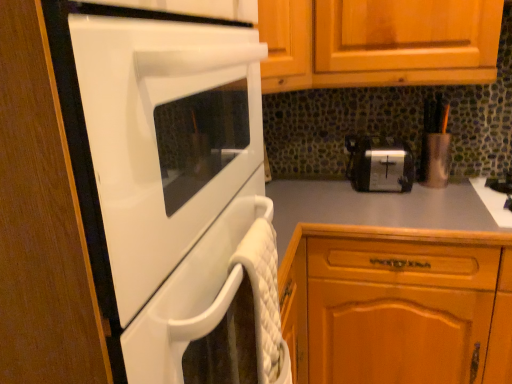
What is the approximate width of wooden cabinet at lower right?

wooden cabinet at lower right is 62.90 centimeters in width.

At what (x,y) coordinates should I click in order to perform the action: click on silver metallic toaster at center. Please return your answer as a coordinate pair (x, y). Looking at the image, I should click on (379, 164).

What is the approximate height of silver metallic toaster at center?

18.10 centimeters.

In order to click on wooden cabinet at lower right in this screenshot , I will do `click(397, 305)`.

Is white glossy oven at left taller or shorter than black matte gas stove at right?

white glossy oven at left is taller than black matte gas stove at right.

From a real-world perspective, who is located higher, white glossy oven at left or black matte gas stove at right?

In real-world perspective, white glossy oven at left is above.

Can you tell me how much white glossy oven at left and black matte gas stove at right differ in facing direction?

There is a 90-degree angle between the facing directions of white glossy oven at left and black matte gas stove at right.

Could you tell me if white glossy oven at left is facing black matte gas stove at right?

No, white glossy oven at left does not turn towards black matte gas stove at right.

From the image's perspective, is black matte gas stove at right over white glossy oven at left?

Correct, black matte gas stove at right appears higher than white glossy oven at left in the image.

Is white glossy oven at left a part of black matte gas stove at right?

Actually, white glossy oven at left is outside black matte gas stove at right.

Which object is wider, black matte gas stove at right or white glossy oven at left?

With larger width is white glossy oven at left.

Is silver metallic toaster at center spatially inside black matte gas stove at right, or outside of it?

silver metallic toaster at center is outside black matte gas stove at right.

From the image's perspective, is silver metallic toaster at center on top of black matte gas stove at right?

Yes, from the image's perspective, silver metallic toaster at center is above black matte gas stove at right.

Can you tell me how much silver metallic toaster at center and black matte gas stove at right differ in facing direction?

silver metallic toaster at center and black matte gas stove at right are facing 0.00273 degrees away from each other.

Which object is positioned more to the left, silver metallic toaster at center or black matte gas stove at right?

silver metallic toaster at center.

From a real-world perspective, between wooden cabinet at lower right and silver metallic toaster at center, who is vertically higher?

silver metallic toaster at center, from a real-world perspective.

Is silver metallic toaster at center inside wooden cabinet at lower right?

No, silver metallic toaster at center is located outside of wooden cabinet at lower right.

Consider the image. In terms of height, does wooden cabinet at lower right look taller or shorter compared to silver metallic toaster at center?

In the image, wooden cabinet at lower right appears to be taller than silver metallic toaster at center.

Who is more distant, black matte gas stove at right or wooden cabinet at lower right?

black matte gas stove at right is behind.

You are a GUI agent. You are given a task and a screenshot of the screen. Output one action in this format:
    pyautogui.click(x=<x>, y=<y>)
    Task: Click on the cabinetry in front of the black matte gas stove at right
    The width and height of the screenshot is (512, 384).
    Given the screenshot: What is the action you would take?
    pyautogui.click(x=397, y=305)

Is wooden cabinet at lower right located within black matte gas stove at right?

Actually, wooden cabinet at lower right is outside black matte gas stove at right.

From a real-world perspective, which object stands above the other?

white glossy oven at left, from a real-world perspective.

Is point (85, 80) in front of point (364, 161)?

Yes, point (85, 80) is closer to viewer.

From the image's perspective, relative to silver metallic toaster at center, is white glossy oven at left above or below?

white glossy oven at left is below silver metallic toaster at center.

In the image, is white glossy oven at left positioned in front of or behind silver metallic toaster at center?

white glossy oven at left is in front of silver metallic toaster at center.

Based on the photo, is wooden cabinet at lower right directly adjacent to white glossy oven at left?

No, wooden cabinet at lower right is not in contact with white glossy oven at left.

How different are the orientations of wooden cabinet at lower right and white glossy oven at left in degrees?

They differ by 90 degrees in their facing directions.

Is wooden cabinet at lower right positioned behind white glossy oven at left?

Yes, wooden cabinet at lower right is further from the camera.

Which is behind, point (354, 320) or point (194, 38)?

The point (354, 320) is farther from the camera.

Locate an element on the screen. gas stove on the right of white glossy oven at left is located at coordinates (x=493, y=202).

Image resolution: width=512 pixels, height=384 pixels. In order to click on home appliance below the black matte gas stove at right (from the image's perspective) in this screenshot , I will do `click(165, 136)`.

From the image, which object appears to be nearer to wooden cabinet at lower right, white glossy oven at left or black matte gas stove at right?

black matte gas stove at right.

Considering their positions, is wooden cabinet at lower right positioned further to silver metallic toaster at center than black matte gas stove at right?

wooden cabinet at lower right is positioned further to the anchor silver metallic toaster at center.

When comparing their distances from silver metallic toaster at center, does white glossy oven at left or black matte gas stove at right seem further?

Among the two, white glossy oven at left is located further to silver metallic toaster at center.

Consider the image. Based on their spatial positions, is wooden cabinet at lower right or silver metallic toaster at center further from white glossy oven at left?

silver metallic toaster at center is further to white glossy oven at left.

From the image, which object appears to be farther from white glossy oven at left, silver metallic toaster at center or black matte gas stove at right?

Based on the image, black matte gas stove at right appears to be further to white glossy oven at left.

Which object lies nearer to the anchor point black matte gas stove at right, wooden cabinet at lower right or silver metallic toaster at center?

silver metallic toaster at center is closer to black matte gas stove at right.

Based on their spatial positions, is white glossy oven at left or wooden cabinet at lower right further from silver metallic toaster at center?

white glossy oven at left lies further to silver metallic toaster at center than the other object.

From the image, which object appears to be nearer to silver metallic toaster at center, black matte gas stove at right or white glossy oven at left?

black matte gas stove at right.

At what (x,y) coordinates should I click in order to perform the action: click on cabinetry between white glossy oven at left and silver metallic toaster at center from front to back. Please return your answer as a coordinate pair (x, y). Looking at the image, I should click on (397, 305).

Identify the location of gas stove between white glossy oven at left and silver metallic toaster at center in the front-back direction. Image resolution: width=512 pixels, height=384 pixels. (493, 202).

The height and width of the screenshot is (384, 512). Identify the location of gas stove between silver metallic toaster at center and wooden cabinet at lower right in the vertical direction. (493, 202).

At what (x,y) coordinates should I click in order to perform the action: click on cabinetry between white glossy oven at left and black matte gas stove at right from left to right. Please return your answer as a coordinate pair (x, y). This screenshot has width=512, height=384. Looking at the image, I should click on (397, 305).